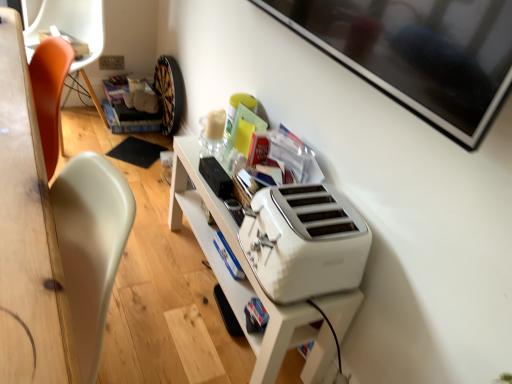
Question: Is white plastic toaster at lower center closer to the viewer compared to orange plastic chair at left?

Choices:
 (A) yes
 (B) no

Answer: (A)

Question: From a real-world perspective, is white plastic toaster at lower center under orange plastic chair at left?

Choices:
 (A) yes
 (B) no

Answer: (B)

Question: Is white plastic toaster at lower center turned away from orange plastic chair at left?

Choices:
 (A) yes
 (B) no

Answer: (B)

Question: Is white plastic toaster at lower center aimed at orange plastic chair at left?

Choices:
 (A) yes
 (B) no

Answer: (B)

Question: Is white plastic toaster at lower center with orange plastic chair at left?

Choices:
 (A) yes
 (B) no

Answer: (B)

Question: Is white plastic toaster at lower center positioned behind orange plastic chair at left?

Choices:
 (A) yes
 (B) no

Answer: (B)

Question: Would you say white plastic toaster at lower center is part of orange plastic chair at left's contents?

Choices:
 (A) yes
 (B) no

Answer: (B)

Question: Does orange plastic chair at left have a greater height compared to white plastic toaster at lower center?

Choices:
 (A) yes
 (B) no

Answer: (A)

Question: Is orange plastic chair at left oriented towards white plastic toaster at lower center?

Choices:
 (A) yes
 (B) no

Answer: (B)

Question: Is orange plastic chair at left at the left side of white plastic toaster at lower center?

Choices:
 (A) no
 (B) yes

Answer: (B)

Question: From a real-world perspective, is orange plastic chair at left on top of white plastic toaster at lower center?

Choices:
 (A) no
 (B) yes

Answer: (A)

Question: From the image's perspective, is orange plastic chair at left above white plastic toaster at lower center?

Choices:
 (A) yes
 (B) no

Answer: (A)

Question: Relative to orange plastic chair at left, is white plastic toaster at lower center in front or behind?

Choices:
 (A) front
 (B) behind

Answer: (A)